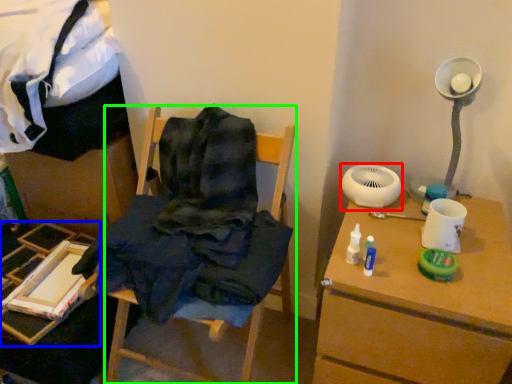
Question: Which is nearer to the mechanical fan (highlighted by a red box)? furniture (highlighted by a blue box) or furniture (highlighted by a green box).

Choices:
 (A) furniture
 (B) furniture

Answer: (B)